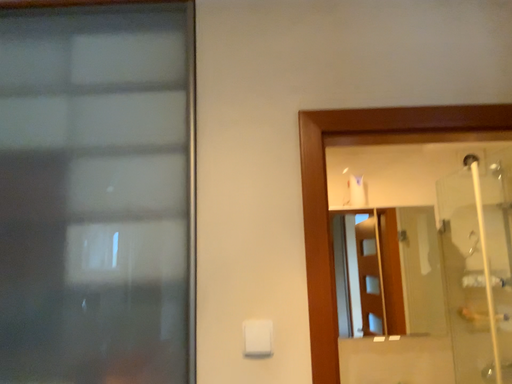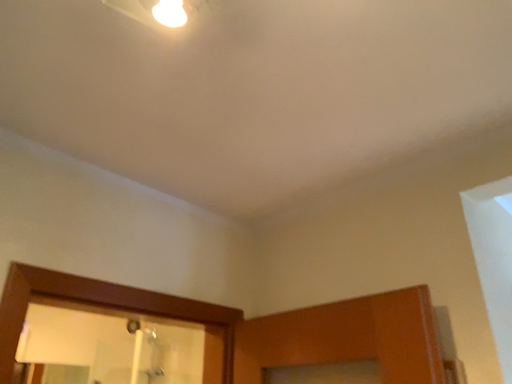
Question: Which way did the camera rotate in the video?

Choices:
 (A) rotated right
 (B) rotated left

Answer: (A)